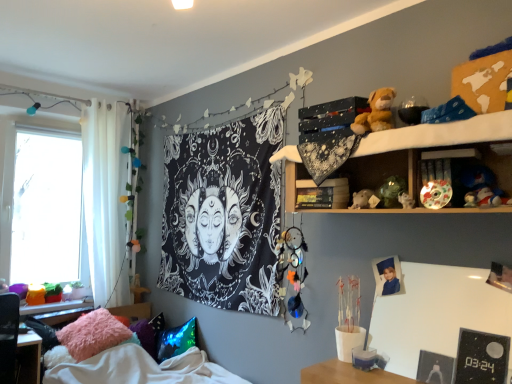
Question: Is shiny multicolored ball at upper right, the third toy in the top-to-bottom sequence, closer to camera compared to white sheer curtain at left?

Choices:
 (A) yes
 (B) no

Answer: (A)

Question: Is shiny multicolored ball at upper right, which is the 4th toy from bottom to top, at the left side of white sheer curtain at left?

Choices:
 (A) yes
 (B) no

Answer: (B)

Question: Can you confirm if shiny multicolored ball at upper right, positioned as the 5th toy in left-to-right order, is thinner than white sheer curtain at left?

Choices:
 (A) no
 (B) yes

Answer: (B)

Question: Considering the relative sizes of shiny multicolored ball at upper right, marked as the 2th toy in a right-to-left arrangement, and white sheer curtain at left in the image provided, is shiny multicolored ball at upper right, marked as the 2th toy in a right-to-left arrangement, bigger than white sheer curtain at left?

Choices:
 (A) yes
 (B) no

Answer: (B)

Question: From a real-world perspective, is shiny multicolored ball at upper right, positioned as the 5th toy in left-to-right order, below white sheer curtain at left?

Choices:
 (A) yes
 (B) no

Answer: (B)

Question: From the image's perspective, is porcelain plate at upper right above or below fuzzy fabric pillow at lower left, arranged as the second pillow when viewed from the left?

Choices:
 (A) above
 (B) below

Answer: (A)

Question: Considering their positions, is porcelain plate at upper right located in front of or behind fuzzy fabric pillow at lower left, marked as the 2th pillow in a right-to-left arrangement?

Choices:
 (A) behind
 (B) front

Answer: (B)

Question: Looking at their shapes, would you say porcelain plate at upper right is wider or thinner than fuzzy fabric pillow at lower left, marked as the 2th pillow in a right-to-left arrangement?

Choices:
 (A) thin
 (B) wide

Answer: (A)

Question: Do you think porcelain plate at upper right is within fuzzy fabric pillow at lower left, marked as the 2th pillow in a right-to-left arrangement, or outside of it?

Choices:
 (A) inside
 (B) outside

Answer: (B)

Question: Is porcelain plate at upper right inside or outside of white glossy figurine at upper right, placed as the 2th toy when sorted from bottom to top?

Choices:
 (A) outside
 (B) inside

Answer: (A)

Question: Based on their positions, is porcelain plate at upper right located to the left or right of white glossy figurine at upper right, which is the fourth toy from left to right?

Choices:
 (A) right
 (B) left

Answer: (A)

Question: In terms of size, does porcelain plate at upper right appear bigger or smaller than white glossy figurine at upper right, which ranks as the fifth toy in top-to-bottom order?

Choices:
 (A) small
 (B) big

Answer: (B)

Question: In terms of width, does porcelain plate at upper right look wider or thinner when compared to white glossy figurine at upper right, which is the fourth toy from left to right?

Choices:
 (A) thin
 (B) wide

Answer: (B)

Question: In terms of size, does shiny multicolored ball at upper right, positioned as the 5th toy in left-to-right order, appear bigger or smaller than multicolored dreamcatcher at center, the 6th toy when ordered from top to bottom?

Choices:
 (A) big
 (B) small

Answer: (B)

Question: From a real-world perspective, relative to multicolored dreamcatcher at center, the first toy in the left-to-right sequence, is shiny multicolored ball at upper right, the third toy in the top-to-bottom sequence, vertically above or below?

Choices:
 (A) above
 (B) below

Answer: (A)